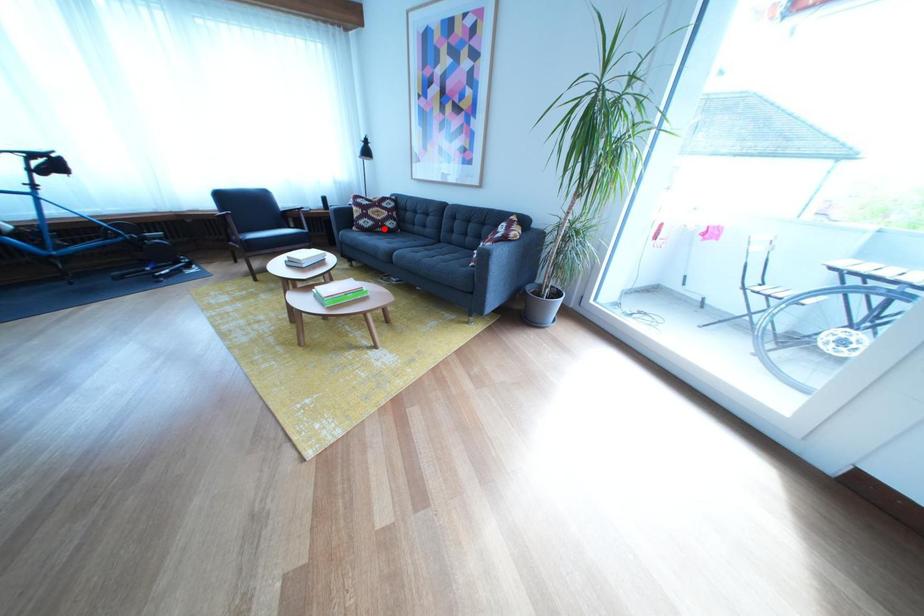
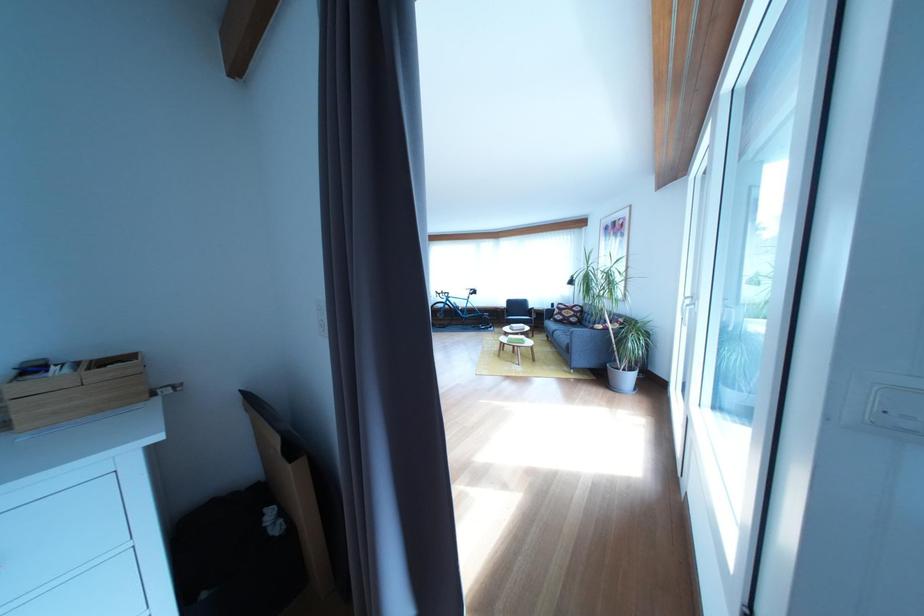
In the second image, find the point that corresponds to the highlighted location in the first image.

(575, 323)